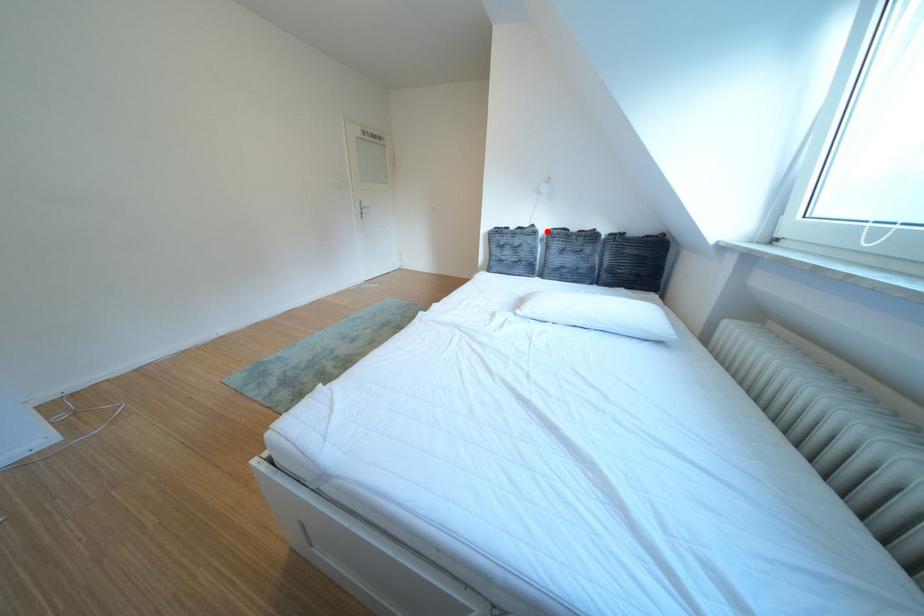
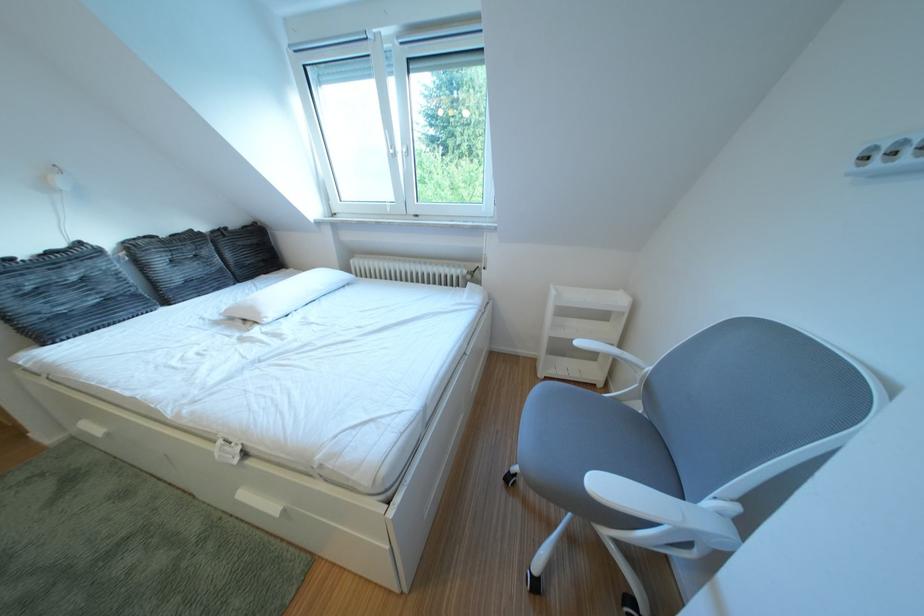
Question: I am providing you with two images of the same scene from different viewpoints. Image1 has a red point marked. In image2, the corresponding 3D location appears at what relative position? Reply with the corresponding letter.

Choices:
 (A) Closer
 (B) Farther

Answer: (B)